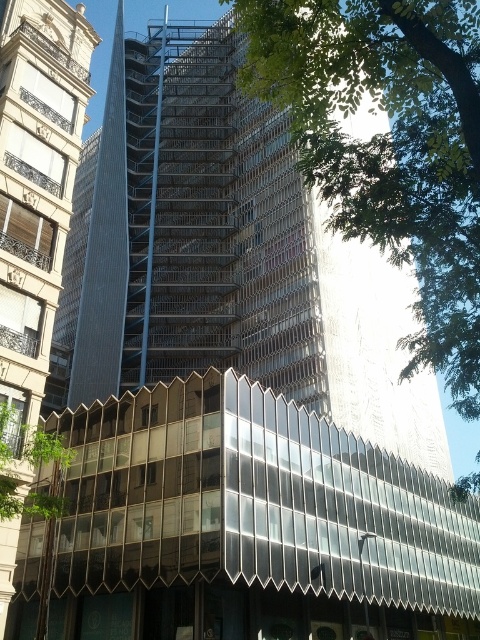
You are standing at the base of the tall building with the zigzag glass panels and looking towards the classical structure on the left. You notice two points marked in the scene. Which of the two points, point (294,134) or point (13,228), is closer to you?

Point (294,134) is closer to you because it is in front of point (13,228).

You are a drone operator planning to fly a drone from the green leafy tree at upper right to the glassy reflective tower at center. What is the minimum horizontal distance the drone must cover to reach the tower?

The minimum horizontal distance the drone must cover to reach the glassy reflective tower at center from the green leafy tree at upper right is 17.64 meters.

You are an architect analyzing the spatial relationship between the green leafy tree at upper right and the glassy reflective tower at center. Based on the scene, which object is positioned higher in the image?

The green leafy tree at upper right is located below the glassy reflective tower at center, so the glassy reflective tower at center is positioned higher in the image.